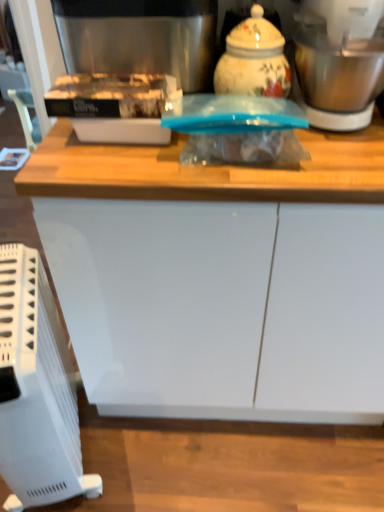
Describe the element at coordinates (129, 64) in the screenshot. The height and width of the screenshot is (512, 384). I see `stainless steel coffee machine at upper center` at that location.

What do you see at coordinates (218, 277) in the screenshot? I see `white glossy cabinet at center` at bounding box center [218, 277].

Describe the element at coordinates (339, 62) in the screenshot. The width and height of the screenshot is (384, 512). I see `stainless steel blender at upper right` at that location.

I want to click on decorative ceramic jar at upper center, so click(254, 59).

Identify the location of matte plastic container at upper left. The image size is (384, 512). point(109,96).

In order to click on white plastic heater at lower left in this screenshot , I will do `click(36, 390)`.

Does stainless steel coffee machine at upper center have a larger size compared to white glossy cabinet at center?

Actually, stainless steel coffee machine at upper center might be smaller than white glossy cabinet at center.

In the scene shown: From a real-world perspective, is stainless steel coffee machine at upper center over white glossy cabinet at center?

Yes, from a real-world perspective, stainless steel coffee machine at upper center is on top of white glossy cabinet at center.

Could you measure the distance between stainless steel coffee machine at upper center and white glossy cabinet at center?

The distance of stainless steel coffee machine at upper center from white glossy cabinet at center is 12.18 inches.

In the scene shown: From the image's perspective, between stainless steel coffee machine at upper center and white glossy cabinet at center, who is located below?

white glossy cabinet at center, from the image's perspective.

Looking at this image, is matte plastic container at upper left not near decorative ceramic jar at upper center?

No, there isn't a large distance between matte plastic container at upper left and decorative ceramic jar at upper center.

Is decorative ceramic jar at upper center at the back of matte plastic container at upper left?

No, matte plastic container at upper left's orientation is not away from decorative ceramic jar at upper center.

Which of these two, matte plastic container at upper left or decorative ceramic jar at upper center, is smaller?

matte plastic container at upper left is smaller.

From a real-world perspective, which is physically below, matte plastic container at upper left or decorative ceramic jar at upper center?

Result: matte plastic container at upper left is physically lower.

Consider the image. Does stainless steel blender at upper right appear on the left side of decorative ceramic jar at upper center?

No, stainless steel blender at upper right is not to the left of decorative ceramic jar at upper center.

Which is further, (379, 47) or (269, 24)?

Positioned behind is point (269, 24).

Does stainless steel blender at upper right come in front of decorative ceramic jar at upper center?

Yes, stainless steel blender at upper right is in front of decorative ceramic jar at upper center.

Can you tell me how much stainless steel coffee machine at upper center and matte plastic container at upper left differ in facing direction?

1.6 degrees.

Looking at their sizes, would you say stainless steel coffee machine at upper center is wider or thinner than matte plastic container at upper left?

Clearly, stainless steel coffee machine at upper center has more width compared to matte plastic container at upper left.

Does stainless steel coffee machine at upper center have a lesser height compared to matte plastic container at upper left?

No.

From a real-world perspective, relative to matte plastic container at upper left, is stainless steel coffee machine at upper center vertically above or below?

stainless steel coffee machine at upper center is situated higher than matte plastic container at upper left in the real world.

At what (x,y) coordinates should I click in order to perform the action: click on blender located above the matte plastic container at upper left (from the image's perspective). Please return your answer as a coordinate pair (x, y). The image size is (384, 512). Looking at the image, I should click on (339, 62).

Is matte plastic container at upper left shorter than stainless steel blender at upper right?

Yes.

Is matte plastic container at upper left inside the boundaries of stainless steel blender at upper right, or outside?

matte plastic container at upper left is spatially situated outside stainless steel blender at upper right.

Is point (95, 117) in front of point (327, 18)?

Yes.

From the image's perspective, would you say white plastic heater at lower left is shown under stainless steel coffee machine at upper center?

Correct, white plastic heater at lower left appears lower than stainless steel coffee machine at upper center in the image.

Is white plastic heater at lower left completely or partially outside of stainless steel coffee machine at upper center?

Yes.

Is white plastic heater at lower left far from stainless steel coffee machine at upper center?

white plastic heater at lower left is actually quite close to stainless steel coffee machine at upper center.

Could you tell me if decorative ceramic jar at upper center is facing stainless steel blender at upper right?

No, decorative ceramic jar at upper center is not facing towards stainless steel blender at upper right.

Is decorative ceramic jar at upper center not within stainless steel blender at upper right?

Yes, decorative ceramic jar at upper center is located beyond the bounds of stainless steel blender at upper right.

Can you see decorative ceramic jar at upper center touching stainless steel blender at upper right?

No, decorative ceramic jar at upper center is not next to stainless steel blender at upper right.

Where is `coffee machine on the left of the white glossy cabinet at center`? The height and width of the screenshot is (512, 384). coffee machine on the left of the white glossy cabinet at center is located at coordinates (129, 64).

I want to click on kitchen appliance in front of the matte plastic container at upper left, so click(254, 59).

Which object lies nearer to the anchor point matte plastic container at upper left, stainless steel blender at upper right or stainless steel coffee machine at upper center?

Based on the image, stainless steel coffee machine at upper center appears to be nearer to matte plastic container at upper left.

When comparing their distances from matte plastic container at upper left, does white plastic heater at lower left or stainless steel coffee machine at upper center seem closer?

Among the two, stainless steel coffee machine at upper center is located nearer to matte plastic container at upper left.

From the image, which object appears to be nearer to matte plastic container at upper left, stainless steel blender at upper right or white plastic heater at lower left?

stainless steel blender at upper right is closer to matte plastic container at upper left.

Which object lies further to the anchor point decorative ceramic jar at upper center, stainless steel coffee machine at upper center or matte plastic container at upper left?

Among the two, matte plastic container at upper left is located further to decorative ceramic jar at upper center.

Looking at the image, which one is located further to matte plastic container at upper left, decorative ceramic jar at upper center or stainless steel coffee machine at upper center?

decorative ceramic jar at upper center is further to matte plastic container at upper left.

Looking at the image, which one is located further to stainless steel blender at upper right, decorative ceramic jar at upper center or white plastic heater at lower left?

Among the two, white plastic heater at lower left is located further to stainless steel blender at upper right.

Looking at the image, which one is located further to white glossy cabinet at center, stainless steel blender at upper right or white plastic heater at lower left?

Among the two, stainless steel blender at upper right is located further to white glossy cabinet at center.

Estimate the real-world distances between objects in this image. Which object is further from stainless steel blender at upper right, matte plastic container at upper left or stainless steel coffee machine at upper center?

The object further to stainless steel blender at upper right is matte plastic container at upper left.

The height and width of the screenshot is (512, 384). What are the coordinates of `kitchen appliance between stainless steel blender at upper right and white plastic heater at lower left from top to bottom` in the screenshot? It's located at (254, 59).

Locate an element on the screen. The height and width of the screenshot is (512, 384). cabinetry between stainless steel coffee machine at upper center and white plastic heater at lower left in the vertical direction is located at coordinates (218, 277).

Where is `food that lies between stainless steel coffee machine at upper center and white plastic heater at lower left from top to bottom`? The width and height of the screenshot is (384, 512). food that lies between stainless steel coffee machine at upper center and white plastic heater at lower left from top to bottom is located at coordinates tap(109, 96).

Locate an element on the screen. The height and width of the screenshot is (512, 384). food between stainless steel coffee machine at upper center and white glossy cabinet at center in the up-down direction is located at coordinates (109, 96).